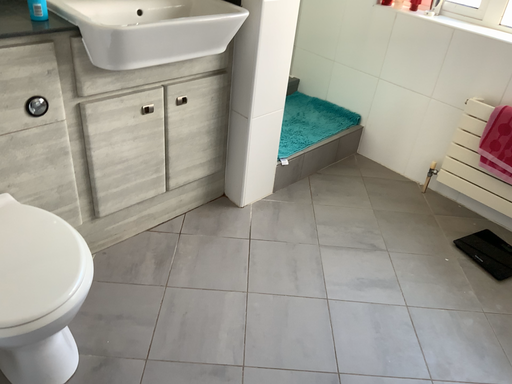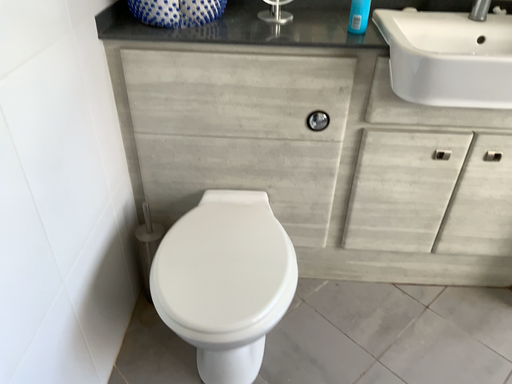
Question: How did the camera likely rotate when shooting the video?

Choices:
 (A) rotated right
 (B) rotated left

Answer: (B)